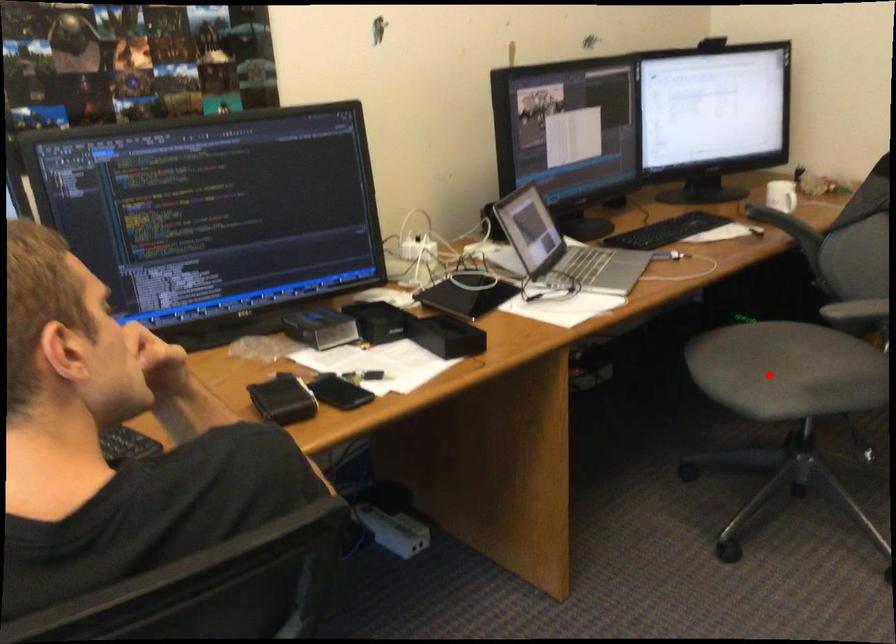
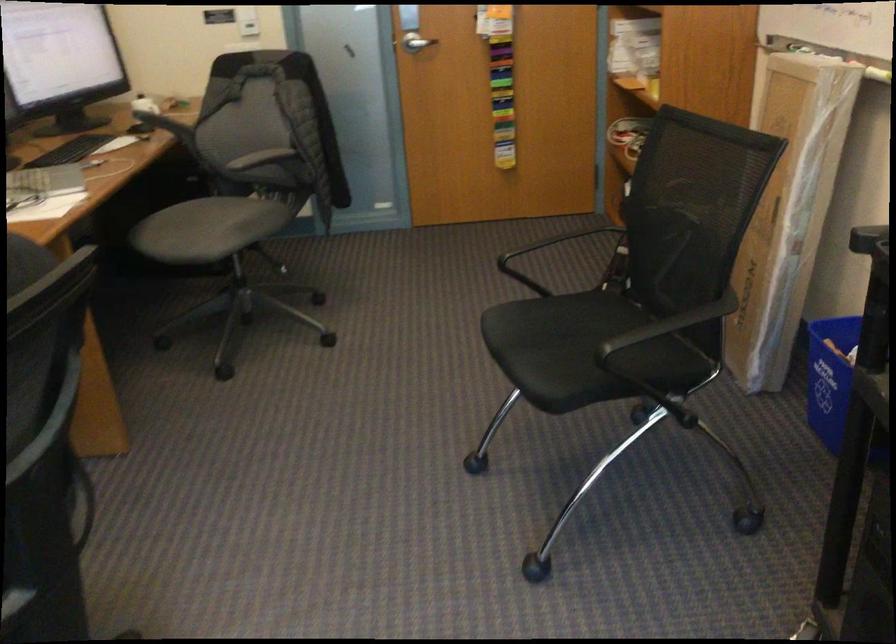
In the second image, find the point that corresponds to the highlighted location in the first image.

(207, 229)